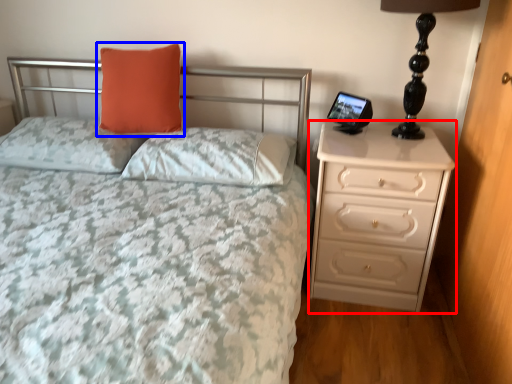
Question: Which object appears closest to the camera in this image, chest of drawers (highlighted by a red box) or pillow (highlighted by a blue box)?

Choices:
 (A) chest of drawers
 (B) pillow

Answer: (A)